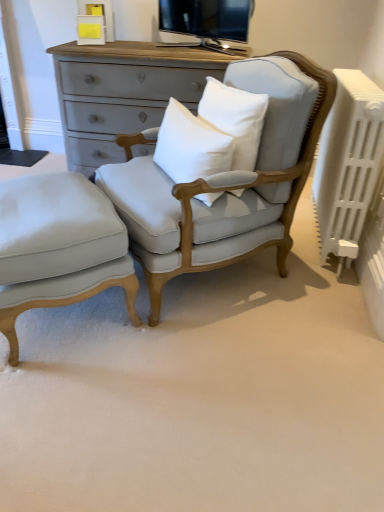
Where is `white cotton pillow at center, the 2th pillow in the right-to-left sequence`? Image resolution: width=384 pixels, height=512 pixels. white cotton pillow at center, the 2th pillow in the right-to-left sequence is located at coordinates (190, 146).

Measure the distance between point (14, 343) and camera.

Point (14, 343) and camera are 1.54 meters apart.

Find the location of a particular element. This screenshot has width=384, height=512. white plastic radiator at right is located at coordinates (348, 164).

What do you see at coordinates (348, 164) in the screenshot? I see `white plastic radiator at right` at bounding box center [348, 164].

This screenshot has width=384, height=512. I want to click on white cotton pillow at center, which appears as the first pillow when viewed from the right, so click(235, 119).

Looking at this image, could white cotton pillow at center, the 2th pillow in the right-to-left sequence, be considered to be inside light gray fabric ottoman at lower left?

No.

From the image's perspective, does light gray fabric ottoman at lower left appear higher than white cotton pillow at center, the 2th pillow in the right-to-left sequence?

Actually, light gray fabric ottoman at lower left appears below white cotton pillow at center, the 2th pillow in the right-to-left sequence, in the image.

Does light gray fabric ottoman at lower left have a greater width compared to white cotton pillow at center, the 2th pillow in the right-to-left sequence?

Yes, light gray fabric ottoman at lower left is wider than white cotton pillow at center, the 2th pillow in the right-to-left sequence.

Considering the sizes of light gray fabric ottoman at lower left and white cotton pillow at center, the 2th pillow in the right-to-left sequence, in the image, is light gray fabric ottoman at lower left taller or shorter than white cotton pillow at center, the 2th pillow in the right-to-left sequence,?

Considering their sizes, light gray fabric ottoman at lower left has more height than white cotton pillow at center, the 2th pillow in the right-to-left sequence.

From the picture: From a real-world perspective, is white cotton pillow at center, the 2th pillow in the right-to-left sequence, located higher than light gray fabric ottoman at lower left?

Yes.

How different are the orientations of white cotton pillow at center, the 2th pillow in the right-to-left sequence, and light gray fabric ottoman at lower left in degrees?

There is a 173-degree angle between the facing directions of white cotton pillow at center, the 2th pillow in the right-to-left sequence, and light gray fabric ottoman at lower left.

This screenshot has width=384, height=512. I want to click on nightstand on the left of white cotton pillow at center, the first pillow in the left-to-right sequence, so click(59, 247).

Does white cotton pillow at center, which appears as the first pillow when viewed from the right, appear on the right side of light gray fabric ottoman at lower left?

Indeed, white cotton pillow at center, which appears as the first pillow when viewed from the right, is positioned on the right side of light gray fabric ottoman at lower left.

From the image's perspective, which one is positioned higher, white cotton pillow at center, the second pillow in the left-to-right sequence, or light gray fabric ottoman at lower left?

white cotton pillow at center, the second pillow in the left-to-right sequence, is shown above in the image.

How different are the orientations of white cotton pillow at center, which appears as the first pillow when viewed from the right, and light gray fabric ottoman at lower left in degrees?

The facing directions of white cotton pillow at center, which appears as the first pillow when viewed from the right, and light gray fabric ottoman at lower left are 177 degrees apart.

Can you confirm if white cotton pillow at center, the second pillow in the left-to-right sequence, is thinner than light gray fabric ottoman at lower left?

Yes.

From a real-world perspective, relative to white cotton pillow at center, the first pillow in the left-to-right sequence, is light gray fabric chair at center vertically above or below?

light gray fabric chair at center is situated lower than white cotton pillow at center, the first pillow in the left-to-right sequence, in the real world.

Between point (223, 220) and point (217, 152), which one is positioned in front?

The point (217, 152) is more forward.

Considering the sizes of objects light gray fabric chair at center and white cotton pillow at center, the first pillow in the left-to-right sequence, in the image provided, who is bigger, light gray fabric chair at center or white cotton pillow at center, the first pillow in the left-to-right sequence,?

Bigger between the two is light gray fabric chair at center.

Considering the relative positions of light gray fabric chair at center and white cotton pillow at center, the first pillow in the left-to-right sequence, in the image provided, is light gray fabric chair at center behind white cotton pillow at center, the first pillow in the left-to-right sequence,?

No, it is not.

This screenshot has height=512, width=384. What are the coordinates of `nightstand that appears below the light gray fabric chair at center (from the image's perspective)` in the screenshot? It's located at (59, 247).

Between light gray fabric ottoman at lower left and light gray fabric chair at center, which one has less height?

Standing shorter between the two is light gray fabric ottoman at lower left.

Is point (104, 232) closer or farther from the camera than point (237, 238)?

Point (104, 232) appears to be closer to the viewer than point (237, 238).

Considering the relative positions of light gray fabric ottoman at lower left and light gray fabric chair at center in the image provided, is light gray fabric ottoman at lower left in front of light gray fabric chair at center?

No, it is not.

Between white cotton pillow at center, the first pillow in the left-to-right sequence, and light gray fabric chair at center, which one has less height?

white cotton pillow at center, the first pillow in the left-to-right sequence, is shorter.

From a real-world perspective, who is located higher, white cotton pillow at center, the first pillow in the left-to-right sequence, or light gray fabric chair at center?

white cotton pillow at center, the first pillow in the left-to-right sequence.

Which object is thinner, white cotton pillow at center, the 2th pillow in the right-to-left sequence, or light gray fabric chair at center?

white cotton pillow at center, the 2th pillow in the right-to-left sequence, is thinner.

Considering the relative sizes of white cotton pillow at center, the 2th pillow in the right-to-left sequence, and white plastic radiator at right in the image provided, is white cotton pillow at center, the 2th pillow in the right-to-left sequence, smaller than white plastic radiator at right?

Correct, white cotton pillow at center, the 2th pillow in the right-to-left sequence, occupies less space than white plastic radiator at right.

Is white cotton pillow at center, the first pillow in the left-to-right sequence, positioned with its back to white plastic radiator at right?

Absolutely, white cotton pillow at center, the first pillow in the left-to-right sequence, is directed away from white plastic radiator at right.

Can we say white cotton pillow at center, the first pillow in the left-to-right sequence, lies outside white plastic radiator at right?

Yes, white cotton pillow at center, the first pillow in the left-to-right sequence, is located beyond the bounds of white plastic radiator at right.

Is point (191, 148) positioned in front of point (355, 145)?

Yes, point (191, 148) is in front of point (355, 145).

The height and width of the screenshot is (512, 384). Identify the location of the 1st pillow behind the light gray fabric ottoman at lower left, starting your count from the anchor. (190, 146).

Locate an element on the screen. This screenshot has height=512, width=384. nightstand on the left of the white cotton pillow at center, the 2th pillow in the right-to-left sequence is located at coordinates (59, 247).

From the picture: Looking at the image, which one is located closer to white cotton pillow at center, the second pillow in the left-to-right sequence, white plastic radiator at right or light gray fabric chair at center?

light gray fabric chair at center.

Based on the photo, which object lies further to the anchor point light gray fabric ottoman at lower left, white cotton pillow at center, the 2th pillow in the right-to-left sequence, or light gray fabric chair at center?

white cotton pillow at center, the 2th pillow in the right-to-left sequence, is positioned further to the anchor light gray fabric ottoman at lower left.

From the image, which object appears to be nearer to light gray fabric ottoman at lower left, white plastic radiator at right or white cotton pillow at center, the 2th pillow in the right-to-left sequence?

white cotton pillow at center, the 2th pillow in the right-to-left sequence, is closer to light gray fabric ottoman at lower left.

Which object lies further to the anchor point white cotton pillow at center, which appears as the first pillow when viewed from the right, light gray fabric chair at center or light gray fabric ottoman at lower left?

light gray fabric ottoman at lower left lies further to white cotton pillow at center, which appears as the first pillow when viewed from the right, than the other object.

From the image, which object appears to be nearer to white cotton pillow at center, the second pillow in the left-to-right sequence, white plastic radiator at right or light gray fabric ottoman at lower left?

The object closer to white cotton pillow at center, the second pillow in the left-to-right sequence, is white plastic radiator at right.

From the image, which object appears to be nearer to light gray fabric ottoman at lower left, light gray fabric chair at center or white cotton pillow at center, which appears as the first pillow when viewed from the right?

light gray fabric chair at center.

Which object lies nearer to the anchor point white cotton pillow at center, the first pillow in the left-to-right sequence, light gray fabric ottoman at lower left or white plastic radiator at right?

light gray fabric ottoman at lower left is positioned closer to the anchor white cotton pillow at center, the first pillow in the left-to-right sequence.

Looking at the image, which one is located further to white cotton pillow at center, the second pillow in the left-to-right sequence, white cotton pillow at center, the first pillow in the left-to-right sequence, or light gray fabric chair at center?

Based on the image, light gray fabric chair at center appears to be further to white cotton pillow at center, the second pillow in the left-to-right sequence.

Image resolution: width=384 pixels, height=512 pixels. What are the coordinates of `pillow between white cotton pillow at center, the 2th pillow in the right-to-left sequence, and white plastic radiator at right from left to right` in the screenshot? It's located at (235, 119).

The height and width of the screenshot is (512, 384). In order to click on chair between light gray fabric ottoman at lower left and white cotton pillow at center, which appears as the first pillow when viewed from the right in this screenshot , I will do `click(223, 180)`.

Locate an element on the screen. Image resolution: width=384 pixels, height=512 pixels. chair situated between light gray fabric ottoman at lower left and white plastic radiator at right from left to right is located at coordinates (223, 180).

You are a GUI agent. You are given a task and a screenshot of the screen. Output one action in this format:
    pyautogui.click(x=<x>, y=<y>)
    Task: Click on the pillow between light gray fabric chair at center and white plastic radiator at right
    The width and height of the screenshot is (384, 512).
    Given the screenshot: What is the action you would take?
    pyautogui.click(x=235, y=119)